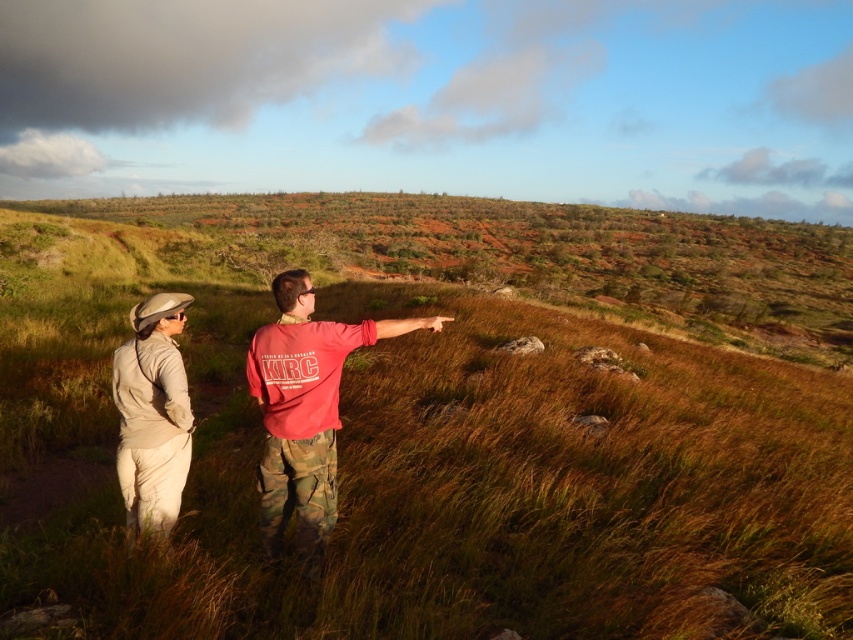
From the picture: Is brown grassy hillside at center to the left of red matte shirt at center from the viewer's perspective?

In fact, brown grassy hillside at center is to the right of red matte shirt at center.

You are a GUI agent. You are given a task and a screenshot of the screen. Output one action in this format:
    pyautogui.click(x=<x>, y=<y>)
    Task: Click on the brown grassy hillside at center
    
    Given the screenshot: What is the action you would take?
    pyautogui.click(x=532, y=256)

This screenshot has width=853, height=640. In order to click on brown grassy hillside at center in this screenshot , I will do `click(532, 256)`.

Does red matte shirt at center have a greater height compared to beige fabric jacket at lower left?

Yes, red matte shirt at center is taller than beige fabric jacket at lower left.

Between red matte shirt at center and beige fabric jacket at lower left, which one has less height?

Standing shorter between the two is beige fabric jacket at lower left.

Identify the location of red matte shirt at center. (305, 408).

At what (x,y) coordinates should I click in order to perform the action: click on red matte shirt at center. Please return your answer as a coordinate pair (x, y). Looking at the image, I should click on (305, 408).

Is brown grass at center to the left of beige fabric jacket at lower left from the viewer's perspective?

Indeed, brown grass at center is positioned on the left side of beige fabric jacket at lower left.

This screenshot has height=640, width=853. I want to click on brown grass at center, so click(440, 420).